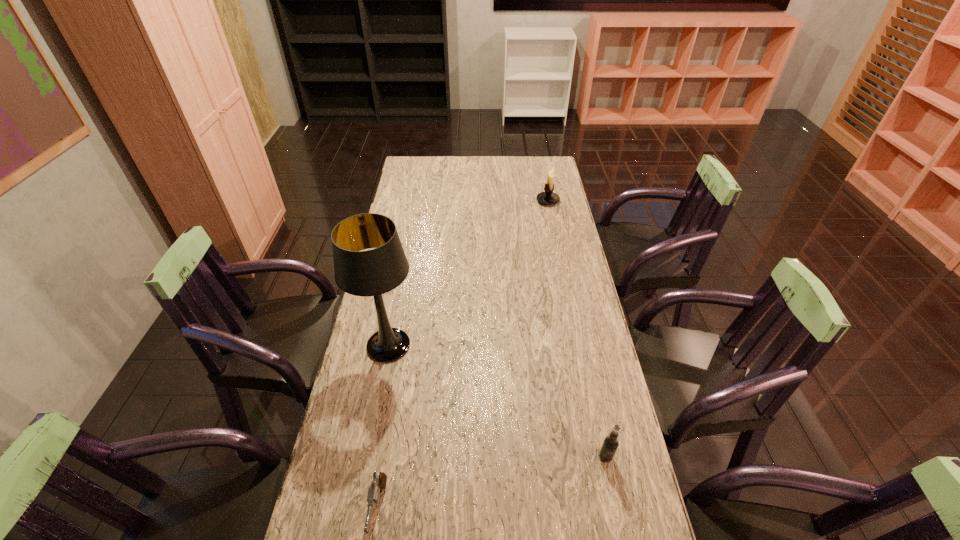
Select which object appears as the closest to the third tallest object. Please provide its 2D coordinates. Your answer should be formatted as a tuple, i.e. [(x, y)], where the tuple contains the x and y coordinates of a point satisfying the conditions above.

[(379, 481)]